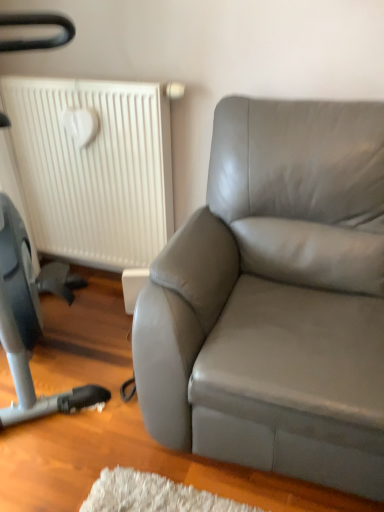
Question: From a real-world perspective, relative to satin gray leather couch at right, is white matte radiator at upper left vertically above or below?

Choices:
 (A) above
 (B) below

Answer: (A)

Question: Choose the correct answer: Is white matte radiator at upper left inside satin gray leather couch at right or outside it?

Choices:
 (A) outside
 (B) inside

Answer: (A)

Question: From their relative heights in the image, would you say white matte radiator at upper left is taller or shorter than satin gray leather couch at right?

Choices:
 (A) tall
 (B) short

Answer: (B)

Question: From a real-world perspective, is satin gray leather couch at right above or below white matte radiator at upper left?

Choices:
 (A) above
 (B) below

Answer: (B)

Question: Is point (342, 250) closer or farther from the camera than point (152, 146)?

Choices:
 (A) closer
 (B) farther

Answer: (A)

Question: In terms of height, does satin gray leather couch at right look taller or shorter compared to white matte radiator at upper left?

Choices:
 (A) tall
 (B) short

Answer: (A)

Question: From the image's perspective, is satin gray leather couch at right located above or below white matte radiator at upper left?

Choices:
 (A) above
 (B) below

Answer: (B)